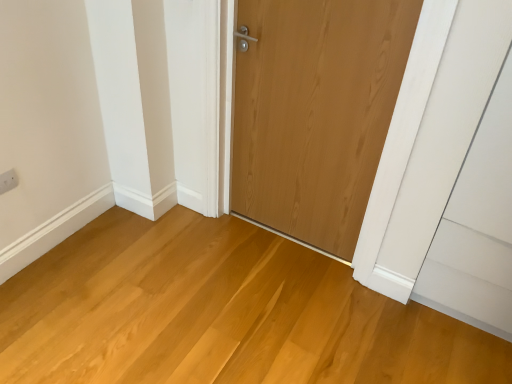
Where is `vacant area situated below natural wood door at center (from a real-world perspective)`? vacant area situated below natural wood door at center (from a real-world perspective) is located at coordinates (282, 233).